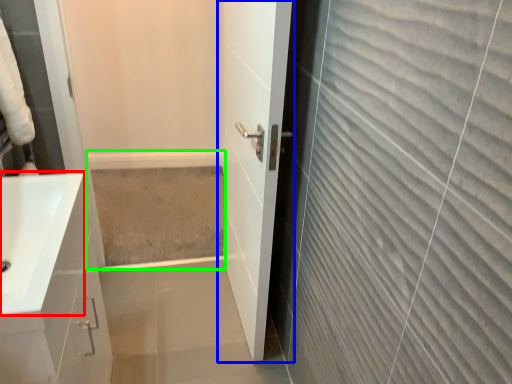
Question: Which is farther away from sink (highlighted by a red box)? door (highlighted by a blue box) or bath (highlighted by a green box)?

Choices:
 (A) door
 (B) bath

Answer: (B)